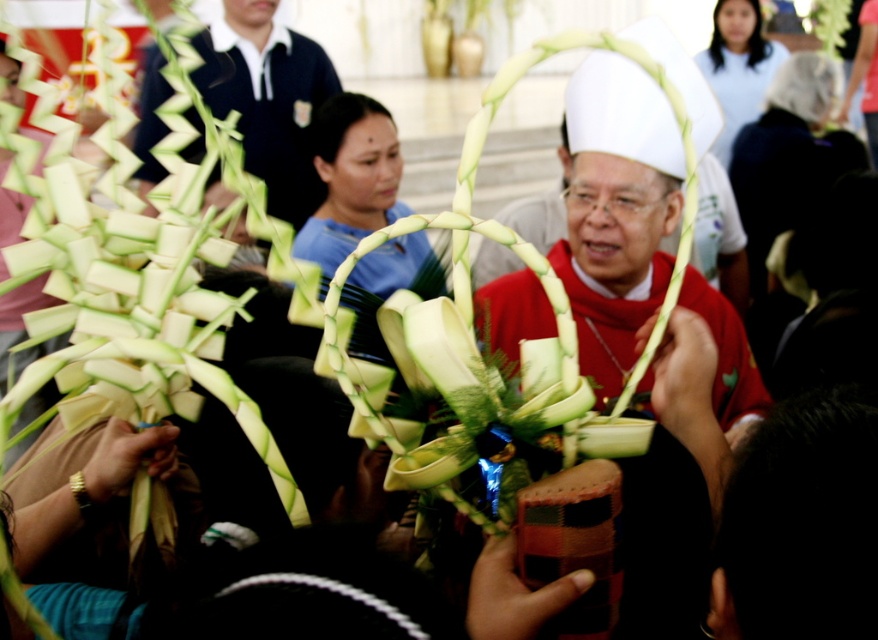
Question: Which point appears farthest from the camera in this image?

Choices:
 (A) (627, 358)
 (B) (306, 124)

Answer: (B)

Question: Does white matte hat at center appear on the right side of matte black polo shirt at upper left?

Choices:
 (A) yes
 (B) no

Answer: (A)

Question: Is white matte hat at center thinner than matte black polo shirt at upper left?

Choices:
 (A) no
 (B) yes

Answer: (B)

Question: Can you confirm if white matte hat at center is smaller than matte black polo shirt at upper left?

Choices:
 (A) yes
 (B) no

Answer: (A)

Question: Which point is farther to the camera?

Choices:
 (A) matte black polo shirt at upper left
 (B) white matte hat at center

Answer: (A)

Question: Among these objects, which one is farthest from the camera?

Choices:
 (A) white matte hat at center
 (B) matte black polo shirt at upper left

Answer: (B)